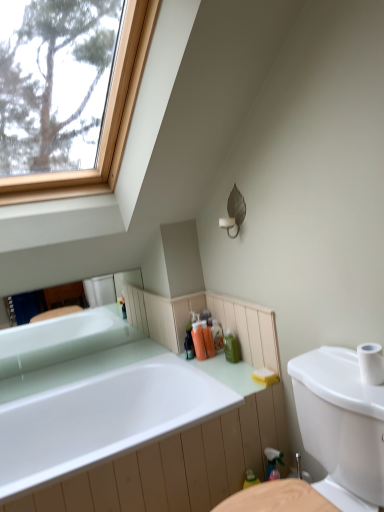
Question: From their relative heights in the image, would you say translucent orange soap at center, positioned as the 3th toiletry in right-to-left order, is taller or shorter than green matte bottle at center, the fourth toiletry from the left?

Choices:
 (A) tall
 (B) short

Answer: (A)

Question: Is translucent orange soap at center, positioned as the 3th toiletry in right-to-left order, inside or outside of green matte bottle at center, the fourth toiletry from the left?

Choices:
 (A) inside
 (B) outside

Answer: (B)

Question: Considering the real-world distances, which object is farthest from the white glossy sink at center?

Choices:
 (A) white glossy bathtub at upper left, placed as the first bathtub when sorted from top to bottom
 (B) white glossy bathtub at center, which appears as the 2th bathtub when viewed from the top
 (C) white matte toilet paper at right
 (D) yellow sponge at lower right
 (E) green matte bottle at center, placed as the 1th toiletry when sorted from right to left

Answer: (A)

Question: Based on their relative distances, which object is nearer to the white glossy sink at center?

Choices:
 (A) translucent plastic bottles at center, which appears as the 3th toiletry when viewed from the left
 (B) green matte bottle at center, the fourth toiletry from the left
 (C) translucent plastic bottles at center, the 4th toiletry positioned from the right
 (D) white glossy bathtub at center, which appears as the 2th bathtub when viewed from the top
 (E) white matte toilet paper at right

Answer: (E)